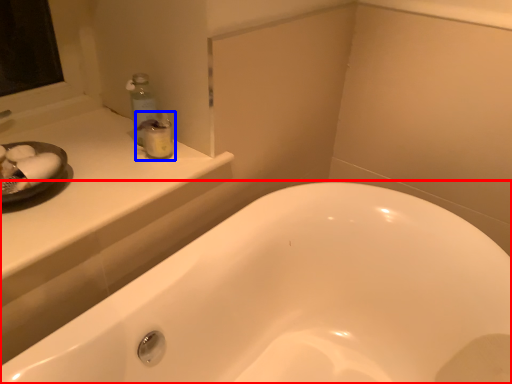
Question: Which of the following is the farthest to the observer, bathtub (highlighted by a red box) or toiletry (highlighted by a blue box)?

Choices:
 (A) bathtub
 (B) toiletry

Answer: (B)